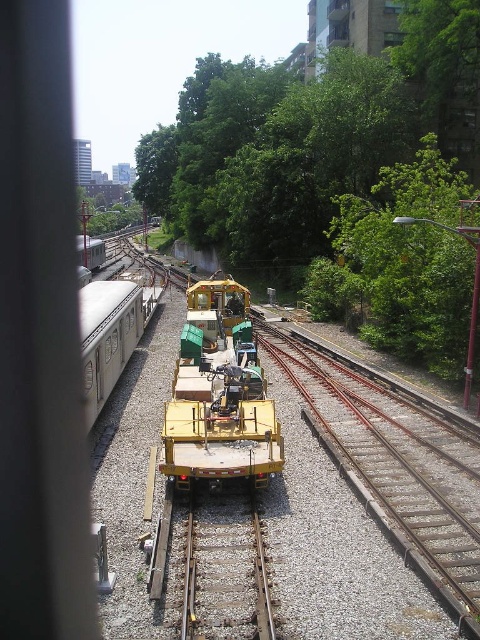
You are a railway inspector standing on the tracks. You notice two tracks below you. Which track is positioned higher, the brown metal train track at center or the smooth metal train track at center?

The brown metal train track at center is positioned higher than the smooth metal train track at center according to the description.

You are standing at the origin point of the image coordinate system. You want to walk to the brown metal train track at center. In which direction should you move?

Since the brown metal train track at center is located at coordinate point (387, 480), you should move towards the right and downward from your current position at the origin to reach it.